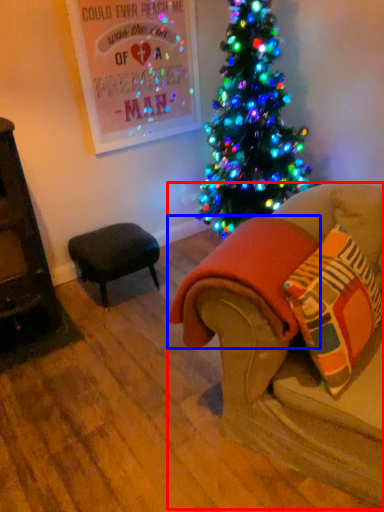
Question: Which object appears farthest to the camera in this image, studio couch (highlighted by a red box) or blanket (highlighted by a blue box)?

Choices:
 (A) studio couch
 (B) blanket

Answer: (B)